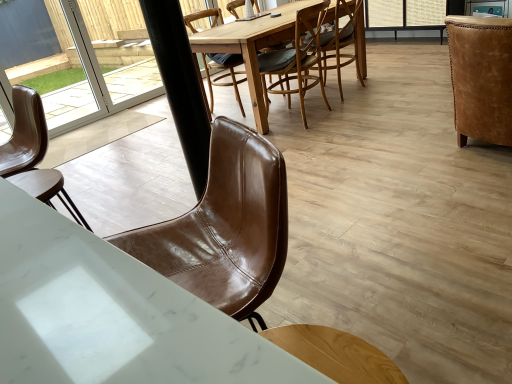
Locate an element on the screen. This screenshot has width=512, height=384. vacant space in front of wooden round table at center is located at coordinates (347, 135).